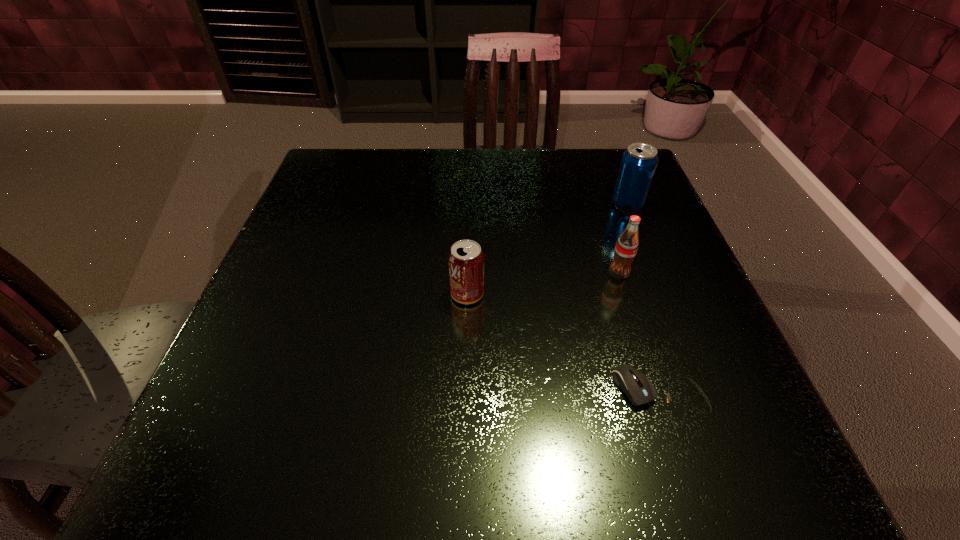
Locate an element on the screen. The height and width of the screenshot is (540, 960). the farthest soda can is located at coordinates (637, 168).

The image size is (960, 540). I want to click on the farthest object, so click(x=637, y=168).

Where is `the second soda can from right to left`? This screenshot has width=960, height=540. the second soda can from right to left is located at coordinates (626, 247).

Identify the location of the second farthest object. pyautogui.click(x=626, y=247).

Where is `the nearest soda can`? The width and height of the screenshot is (960, 540). the nearest soda can is located at coordinates (466, 259).

Find the location of a particular element. This screenshot has height=540, width=960. the shortest soda can is located at coordinates (466, 259).

Identify the location of the nearest object. The image size is (960, 540). (638, 388).

I want to click on the shortest object, so click(638, 388).

Where is `vacant space located on the front of the farthest object`? This screenshot has width=960, height=540. vacant space located on the front of the farthest object is located at coordinates (689, 359).

At what (x,y) coordinates should I click in order to perform the action: click on free point located on the right of the second farthest object. Please return your answer as a coordinate pair (x, y). Looking at the image, I should click on (688, 273).